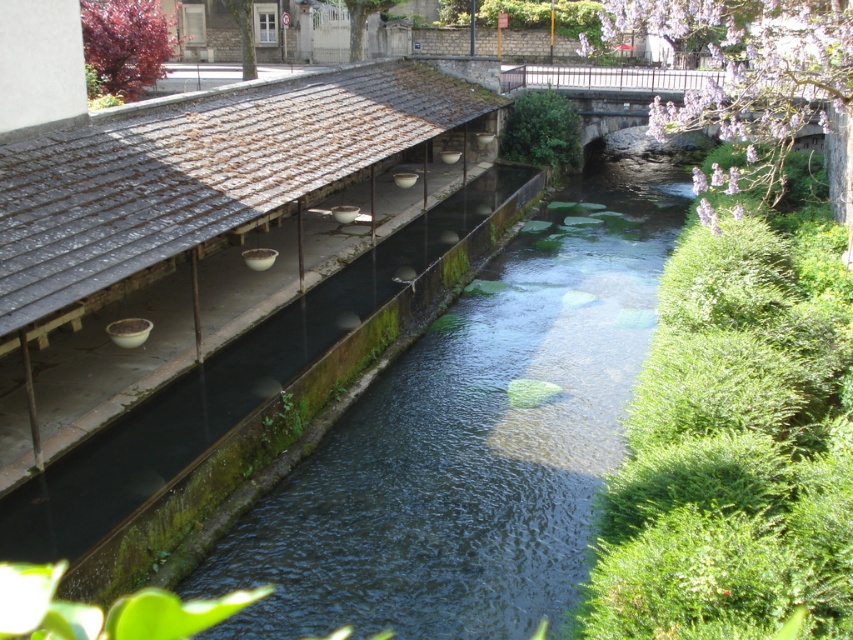
You are a landscape architect designing a garden path. You have two sections of green mossy concrete at left and green mossy concrete at center. Which section would you choose if you need a larger area for planting?

The green mossy concrete at left has a larger size compared to the green mossy concrete at center, so it would be the better choice for a larger planting area.

You are a landscape architect designing a pathway along the canal. You have two sections of green mossy concrete at left and green mossy concrete at center. Which section should you choose if you want to create a raised walkway that is higher than the surrounding ground level?

The green mossy concrete at center should be chosen because it has a greater height compared to the green mossy concrete at left, making it suitable for a raised walkway.